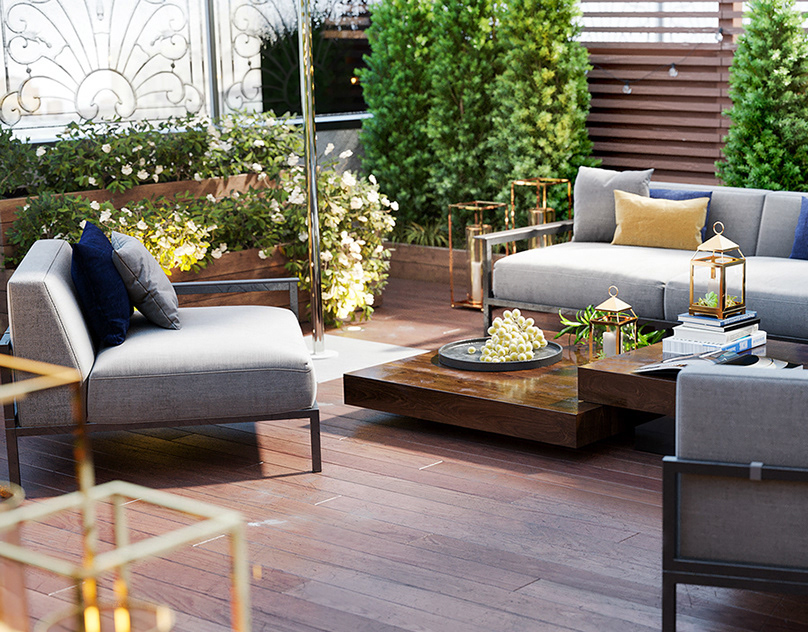
Find the location of a particular element. This screenshot has height=632, width=808. table coffee wooden side is located at coordinates (57, 373).